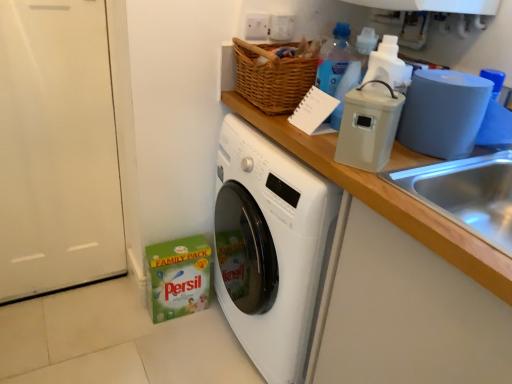
At what (x,y) coordinates should I click in order to perform the action: click on free space above blue matte toilet paper at right (from a real-world perspective). Please return your answer as a coordinate pair (x, y). The height and width of the screenshot is (384, 512). Looking at the image, I should click on (467, 77).